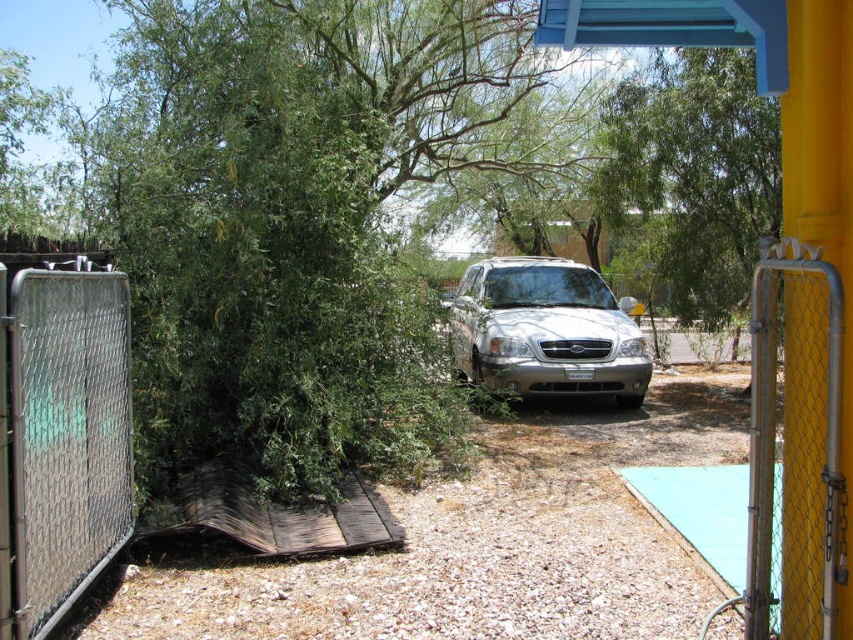
Is silver chain-link fence at left positioned in front of yellow chain-link gate at right?

No, it is behind yellow chain-link gate at right.

Is point (6, 413) closer to viewer compared to point (834, 385)?

That is False.

Is point (0, 566) farther from viewer compared to point (747, 545)?

No, it is not.

Locate an element on the screen. The height and width of the screenshot is (640, 853). silver chain-link fence at left is located at coordinates (61, 438).

Does silver chain-link fence at left lie behind blue painted wood at upper center?

No, silver chain-link fence at left is closer to the viewer.

Between silver chain-link fence at left and blue painted wood at upper center, which one is positioned higher?

blue painted wood at upper center is above.

Where is `silver chain-link fence at left`? silver chain-link fence at left is located at coordinates (61, 438).

Is green leafy tree at upper center smaller than silver metallic suv at center?

No, green leafy tree at upper center is not smaller than silver metallic suv at center.

Identify the location of green leafy tree at upper center. The width and height of the screenshot is (853, 640). (695, 173).

Where is `green leafy tree at upper center`? The width and height of the screenshot is (853, 640). green leafy tree at upper center is located at coordinates (695, 173).